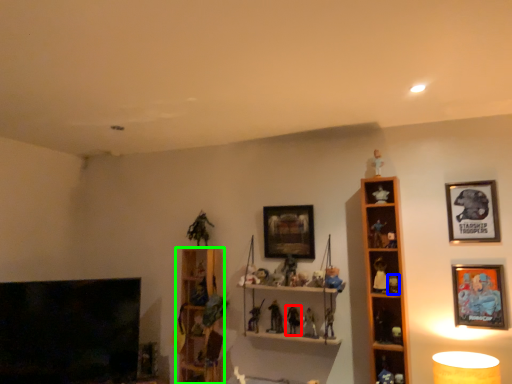
Question: Considering the real-world distances, which object is closest to toy (highlighted by a red box)? toy (highlighted by a blue box) or shelf (highlighted by a green box).

Choices:
 (A) toy
 (B) shelf

Answer: (A)